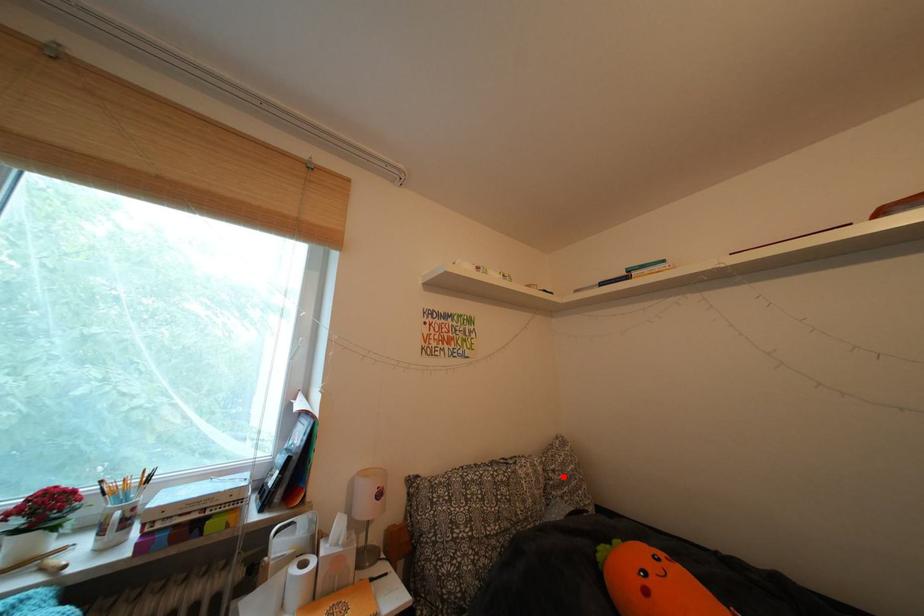
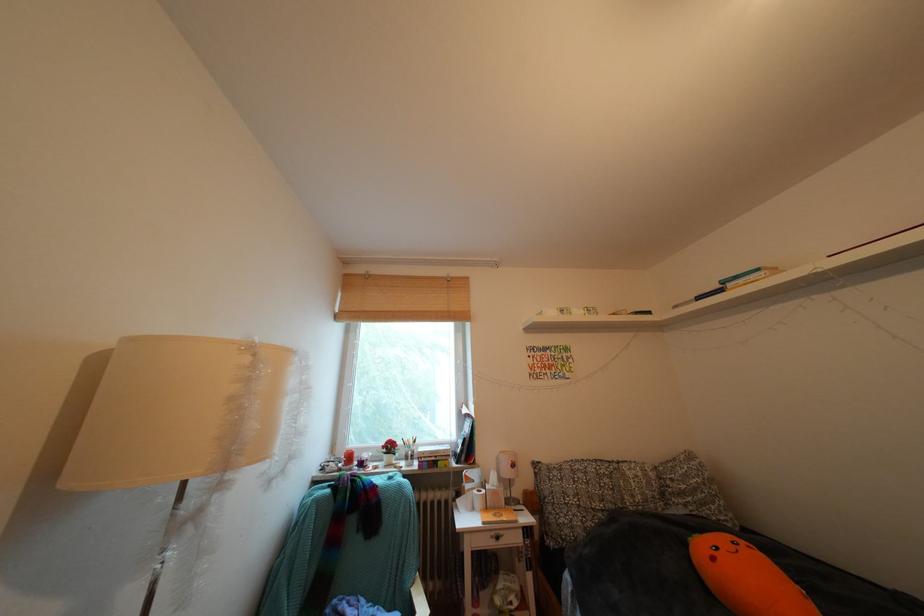
The point at the highlighted location is marked in the first image. Where is the corresponding point in the second image?

(682, 485)